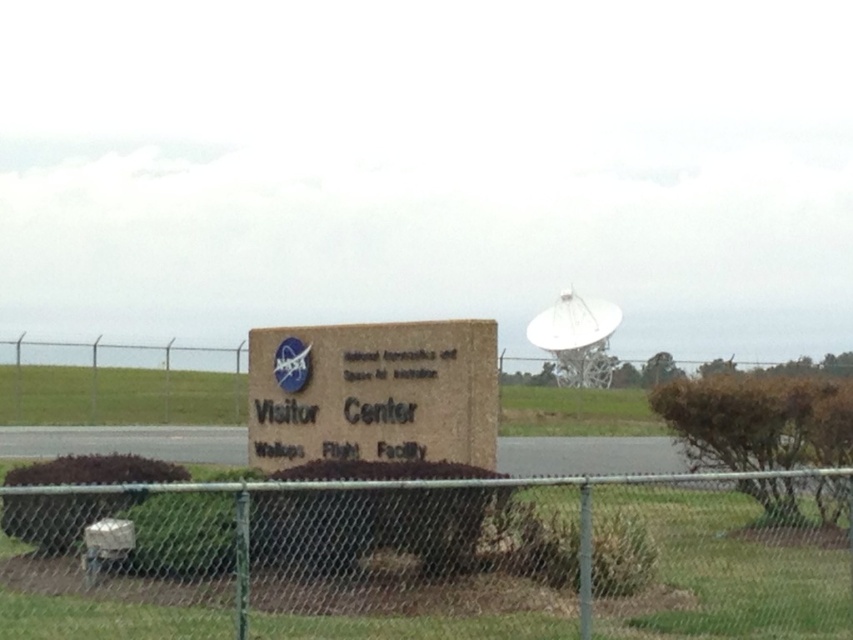
Which is behind, point (604, 609) or point (293, 362)?

The point (293, 362) is more distant.

Is green chain-link fence at center shorter than brown stone visitor center at center?

Indeed, green chain-link fence at center has a lesser height compared to brown stone visitor center at center.

I want to click on green chain-link fence at center, so click(x=436, y=557).

This screenshot has width=853, height=640. In order to click on green chain-link fence at center in this screenshot , I will do `click(436, 557)`.